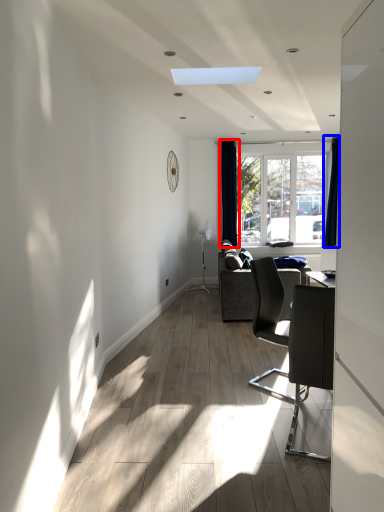
Question: Which point is further to the camera, curtain (highlighted by a red box) or curtain (highlighted by a blue box)?

Choices:
 (A) curtain
 (B) curtain

Answer: (A)